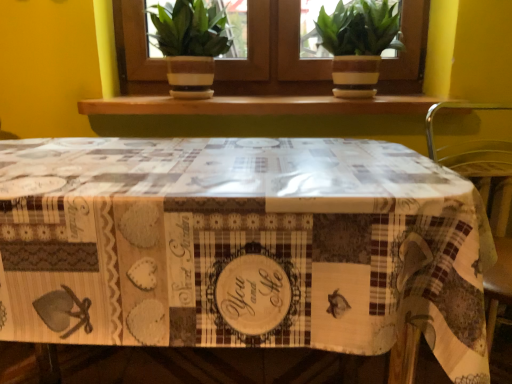
This screenshot has height=384, width=512. Identify the location of green leafy plant at upper center. (273, 57).

This screenshot has height=384, width=512. I want to click on green matte houseplant at upper center, which is the 2th houseplant from left to right, so click(x=358, y=44).

Identify the location of printed fabric tablecloth at center. The width and height of the screenshot is (512, 384). (241, 246).

Measure the distance between point (148,215) and camera.

25.20 inches.

I want to click on wooden at upper center, so click(257, 105).

At what (x,y) coordinates should I click in order to perform the action: click on green leafy plant at upper center. Please return your answer as a coordinate pair (x, y). The image size is (512, 384). Looking at the image, I should click on (273, 57).

Could you tell me if metallic green chair at right is facing printed fabric tablecloth at center?

No, metallic green chair at right is not oriented towards printed fabric tablecloth at center.

Is printed fabric tablecloth at center completely or partially inside metallic green chair at right?

No, metallic green chair at right does not contain printed fabric tablecloth at center.

Considering the relative sizes of metallic green chair at right and printed fabric tablecloth at center in the image provided, is metallic green chair at right smaller than printed fabric tablecloth at center?

Yes.

From a real-world perspective, between metallic green chair at right and printed fabric tablecloth at center, who is vertically higher?

metallic green chair at right is physically above.

Is printed fabric tablecloth at center positioned with its back to metallic green chair at right?

No, metallic green chair at right is not at the back of printed fabric tablecloth at center.

Is metallic green chair at right located within printed fabric tablecloth at center?

Definitely not — metallic green chair at right is not inside printed fabric tablecloth at center.

From a real-world perspective, which object stands above the other?

metallic green chair at right.

Does printed fabric tablecloth at center appear on the left side of metallic green chair at right?

Correct, you'll find printed fabric tablecloth at center to the left of metallic green chair at right.

Is green leafy plant at upper center wider than green matte houseplant at upper center, which is the 1th houseplant from right to left?

No.

Looking at this image, which is less distant, (287, 72) or (395, 31)?

Point (287, 72) is positioned farther from the camera compared to point (395, 31).

Is green leafy plant at upper center looking in the opposite direction of green matte houseplant at upper center, which is the 1th houseplant from right to left?

Yes, green leafy plant at upper center is facing away from green matte houseplant at upper center, which is the 1th houseplant from right to left.

Between green leafy plant at upper center and green matte houseplant at upper center, which is the 1th houseplant from right to left, which one is positioned in front?

green matte houseplant at upper center, which is the 1th houseplant from right to left.

Considering the points (163, 97) and (511, 273), which point is in front, point (163, 97) or point (511, 273)?

Point (511, 273)

Are wooden at upper center and metallic green chair at right far apart?

Actually, wooden at upper center and metallic green chair at right are a little close together.

How much distance is there between wooden at upper center and metallic green chair at right?

wooden at upper center is 18.19 inches from metallic green chair at right.

Is metallic green chair at right at the back of wooden at upper center?

That's not correct — wooden at upper center is not looking away from metallic green chair at right.

Would you consider printed fabric tablecloth at center to be distant from green matte plant at upper center, which appears as the 2th houseplant when viewed from the right?

No, printed fabric tablecloth at center is not far away from green matte plant at upper center, which appears as the 2th houseplant when viewed from the right.

Is printed fabric tablecloth at center in front of or behind green matte plant at upper center, which appears as the 2th houseplant when viewed from the right, in the image?

printed fabric tablecloth at center is positioned closer to the viewer than green matte plant at upper center, which appears as the 2th houseplant when viewed from the right.

How different are the orientations of printed fabric tablecloth at center and green matte plant at upper center, the first houseplant in the left-to-right sequence, in degrees?

0.000554 degrees separate the facing orientations of printed fabric tablecloth at center and green matte plant at upper center, the first houseplant in the left-to-right sequence.

Considering the positions of objects green matte plant at upper center, which appears as the 2th houseplant when viewed from the right, and metallic green chair at right in the image provided, who is in front, green matte plant at upper center, which appears as the 2th houseplant when viewed from the right, or metallic green chair at right?

metallic green chair at right is more forward.

From a real-world perspective, who is located higher, green matte plant at upper center, the first houseplant in the left-to-right sequence, or metallic green chair at right?

From a 3D spatial view, green matte plant at upper center, the first houseplant in the left-to-right sequence, is above.

Is point (213, 65) closer or farther from the camera than point (490, 182)?

Point (213, 65) is farther from the camera than point (490, 182).

Does green matte plant at upper center, which appears as the 2th houseplant when viewed from the right, have a lesser height compared to green matte houseplant at upper center, which is the 2th houseplant from left to right?

No.

Would you say green matte plant at upper center, which appears as the 2th houseplant when viewed from the right, is outside green matte houseplant at upper center, which is the 2th houseplant from left to right?

Yes, green matte plant at upper center, which appears as the 2th houseplant when viewed from the right, is outside of green matte houseplant at upper center, which is the 2th houseplant from left to right.

Does green matte plant at upper center, which appears as the 2th houseplant when viewed from the right, turn towards green matte houseplant at upper center, which is the 2th houseplant from left to right?

No.

The image size is (512, 384). What are the coordinates of `chair above the printed fabric tablecloth at center (from the image's perspective)` in the screenshot? It's located at (490, 214).

Identify the location of chair above the printed fabric tablecloth at center (from a real-world perspective). (490, 214).

Estimate the real-world distances between objects in this image. Which object is further from metallic green chair at right, green matte plant at upper center, the first houseplant in the left-to-right sequence, or wooden at upper center?

Among the two, green matte plant at upper center, the first houseplant in the left-to-right sequence, is located further to metallic green chair at right.

Looking at the image, which one is located further to green matte houseplant at upper center, which is the 2th houseplant from left to right, wooden at upper center or printed fabric tablecloth at center?

printed fabric tablecloth at center is positioned further to the anchor green matte houseplant at upper center, which is the 2th houseplant from left to right.

Consider the image. Estimate the real-world distances between objects in this image. Which object is further from green matte houseplant at upper center, which is the 1th houseplant from right to left, wooden at upper center or green matte plant at upper center, which appears as the 2th houseplant when viewed from the right?

green matte plant at upper center, which appears as the 2th houseplant when viewed from the right.

Considering their positions, is green leafy plant at upper center positioned further to wooden at upper center than printed fabric tablecloth at center?

printed fabric tablecloth at center lies further to wooden at upper center than the other object.

Which object lies nearer to the anchor point metallic green chair at right, green matte houseplant at upper center, which is the 2th houseplant from left to right, or green matte plant at upper center, which appears as the 2th houseplant when viewed from the right?

Among the two, green matte houseplant at upper center, which is the 2th houseplant from left to right, is located nearer to metallic green chair at right.

When comparing their distances from green matte houseplant at upper center, which is the 2th houseplant from left to right, does green leafy plant at upper center or green matte plant at upper center, the first houseplant in the left-to-right sequence, seem further?

Among the two, green matte plant at upper center, the first houseplant in the left-to-right sequence, is located further to green matte houseplant at upper center, which is the 2th houseplant from left to right.

Consider the image. Looking at the image, which one is located further to green matte plant at upper center, which appears as the 2th houseplant when viewed from the right, wooden at upper center or metallic green chair at right?

metallic green chair at right is further to green matte plant at upper center, which appears as the 2th houseplant when viewed from the right.

When comparing their distances from green matte plant at upper center, the first houseplant in the left-to-right sequence, does green matte houseplant at upper center, which is the 1th houseplant from right to left, or printed fabric tablecloth at center seem closer?

The object closer to green matte plant at upper center, the first houseplant in the left-to-right sequence, is green matte houseplant at upper center, which is the 1th houseplant from right to left.

Where is `window sill between green matte plant at upper center, which appears as the 2th houseplant when viewed from the right, and green matte houseplant at upper center, which is the 1th houseplant from right to left, from left to right`? This screenshot has height=384, width=512. window sill between green matte plant at upper center, which appears as the 2th houseplant when viewed from the right, and green matte houseplant at upper center, which is the 1th houseplant from right to left, from left to right is located at coordinates (257, 105).

Find the location of a particular element. window sill between green matte plant at upper center, the first houseplant in the left-to-right sequence, and metallic green chair at right from left to right is located at coordinates (257, 105).

At what (x,y) coordinates should I click in order to perform the action: click on window sill that lies between green leafy plant at upper center and metallic green chair at right from top to bottom. Please return your answer as a coordinate pair (x, y). This screenshot has width=512, height=384. Looking at the image, I should click on (257, 105).

I want to click on chair between printed fabric tablecloth at center and green leafy plant at upper center along the z-axis, so click(x=490, y=214).